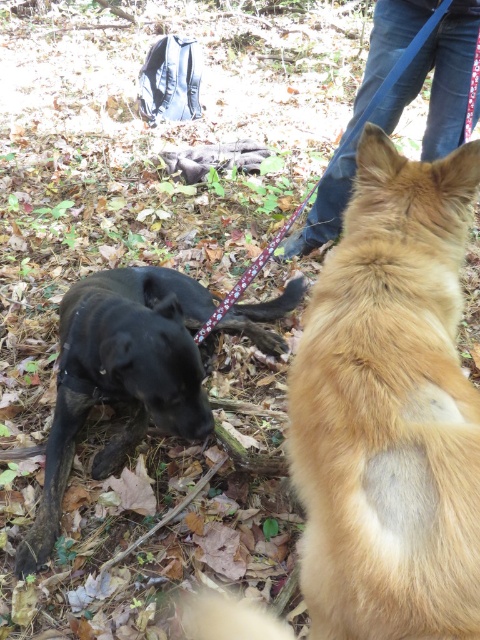
You are a hiker trying to navigate through the forest. You see two markers at coordinates point [380,225] and point [163,388]. Which marker should you head towards if you want to stay closer to the path that is near the ground level?

You should head towards point [380,225] because it is in front of point [163,388], meaning it is closer to the path near the ground level.

You are a photographer trying to capture both the fuzzy golden dog at right and the shiny black dog at lower left in the same frame. Based on their sizes in the image, which dog would appear smaller in the photo?

The fuzzy golden dog at right appears smaller in the photo because it has a lesser width compared to the shiny black dog at lower left.

You are a photographer trying to capture both the fuzzy golden dog at right and the shiny black dog at lower left in a single shot. Based on their sizes in the image, which dog would appear smaller in the final photo?

The fuzzy golden dog at right occupies less space than the shiny black dog at lower left, so it would appear smaller in the photo.